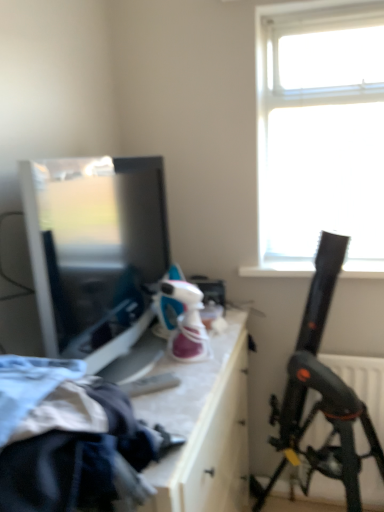
Question: Which is correct: white glossy drawer at center is inside matte black television at left, or outside of it?

Choices:
 (A) inside
 (B) outside

Answer: (B)

Question: Is white glossy drawer at center wider or thinner than matte black television at left?

Choices:
 (A) wide
 (B) thin

Answer: (A)

Question: Which of these objects is positioned closest to the white glossy drawer at center?

Choices:
 (A) matte black television at left
 (B) black plastic telescope at right

Answer: (B)

Question: Considering the real-world distances, which object is closest to the white glossy drawer at center?

Choices:
 (A) matte black television at left
 (B) black plastic telescope at right

Answer: (B)